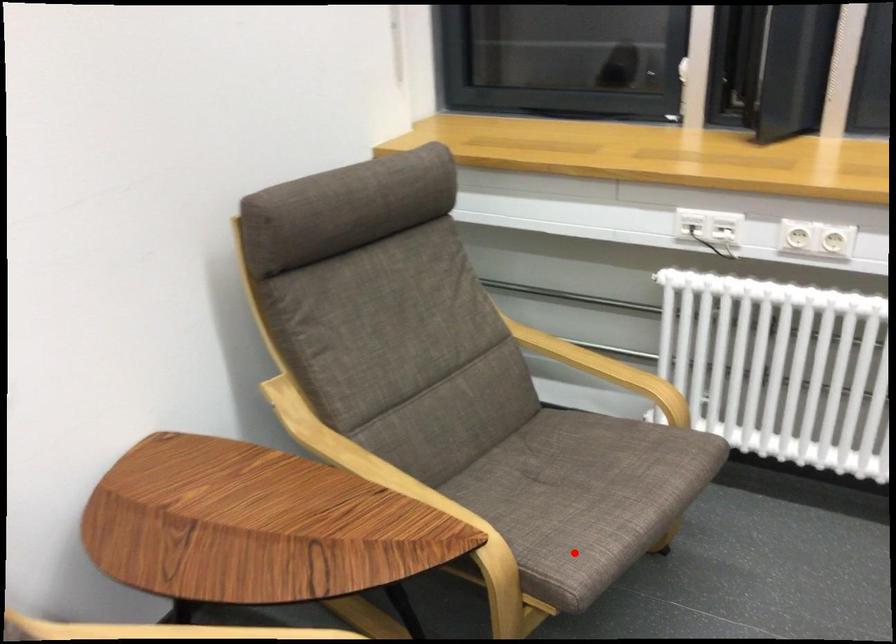
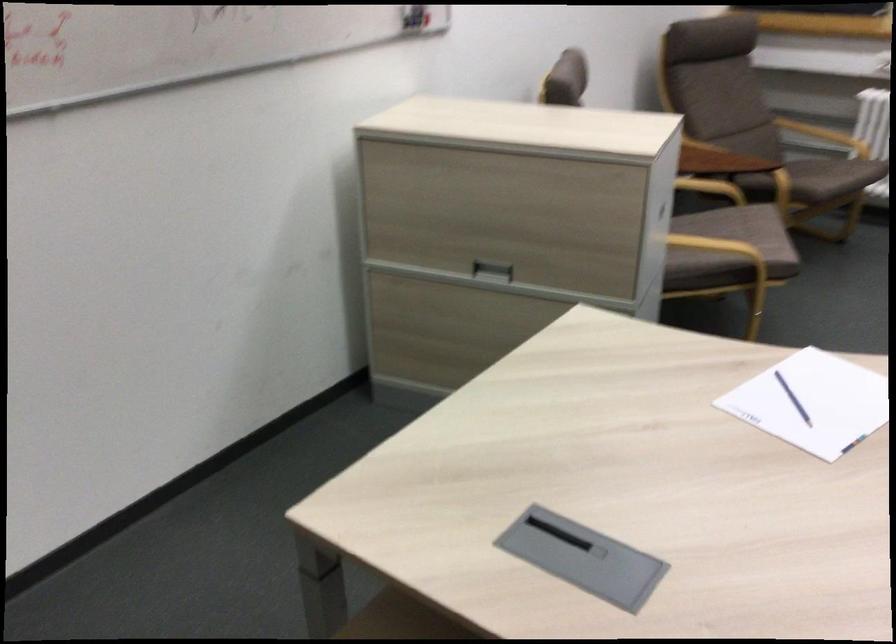
Question: I am providing you with two images of the same scene from different viewpoints. A red point is marked on the first image. Is the red point's position out of view in image 2?

Choices:
 (A) Yes
 (B) No

Answer: (B)